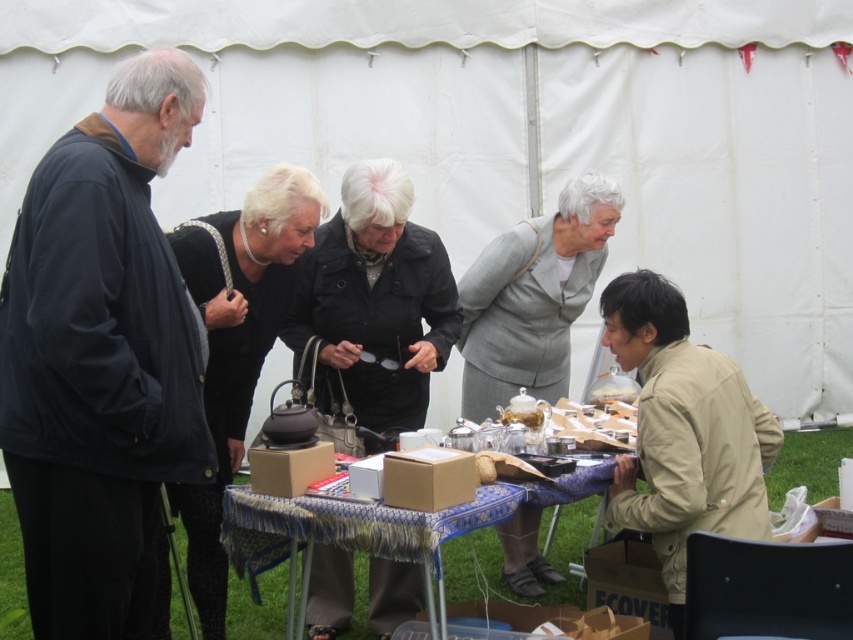
Question: Does tan fabric jacket at lower right appear over black matte teapot at center?

Choices:
 (A) yes
 (B) no

Answer: (B)

Question: Does black leather jacket at center come in front of tan fabric jacket at lower right?

Choices:
 (A) no
 (B) yes

Answer: (A)

Question: Can you confirm if black fabric jacket at left is positioned to the left of tan fabric jacket at lower right?

Choices:
 (A) no
 (B) yes

Answer: (B)

Question: Based on their relative distances, which object is farther from the gray fabric suit at center?

Choices:
 (A) black leather jacket at center
 (B) black matte teapot at center

Answer: (B)

Question: Which point is closer to the camera taking this photo?

Choices:
 (A) (706, 456)
 (B) (480, 518)
 (C) (486, 308)
 (D) (231, 356)

Answer: (B)

Question: Which object is farther from the camera taking this photo?

Choices:
 (A) black matte teapot at center
 (B) tan fabric jacket at lower right
 (C) blue fabric table at center
 (D) black leather jacket at center

Answer: (D)